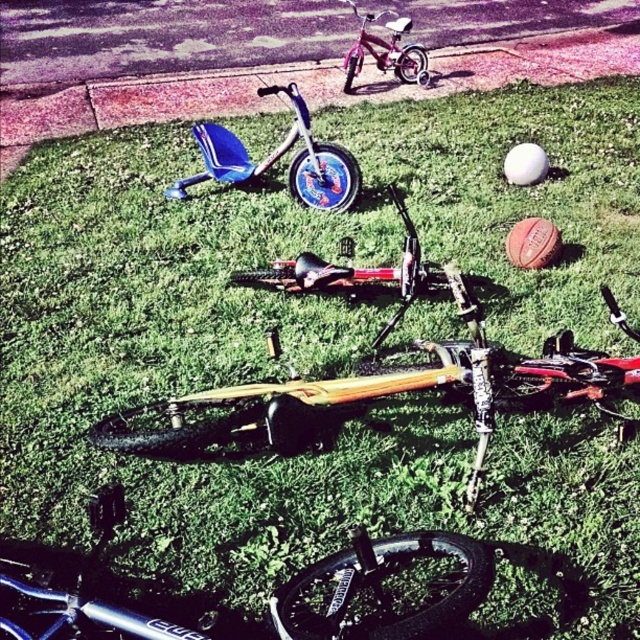
Does shiny blue bicycle at lower center lie behind blue plastic tricycle at center?

That is False.

This screenshot has width=640, height=640. What do you see at coordinates (385, 588) in the screenshot?
I see `shiny blue bicycle at lower center` at bounding box center [385, 588].

Identify the location of shiny blue bicycle at lower center. (385, 588).

Is point (348, 268) farther from camera compared to point (326, 273)?

Yes, it is behind point (326, 273).

Between point (266, 413) and point (410, 285), which one is positioned in front?

Positioned in front is point (266, 413).

Find the location of a particular element. yellow matte bicycle at center is located at coordinates (376, 372).

Who is positioned more to the left, metallic silver bicycle at center or pink metallic bicycle at upper center?

From the viewer's perspective, metallic silver bicycle at center appears more on the left side.

Does metallic silver bicycle at center have a larger size compared to pink metallic bicycle at upper center?

Indeed, metallic silver bicycle at center has a larger size compared to pink metallic bicycle at upper center.

Does point (253, 276) lie behind point (406, 24)?

No, it is in front of (406, 24).

At what (x,y) coordinates should I click in order to perform the action: click on metallic silver bicycle at center. Please return your answer as a coordinate pair (x, y). The height and width of the screenshot is (640, 640). Looking at the image, I should click on (349, 272).